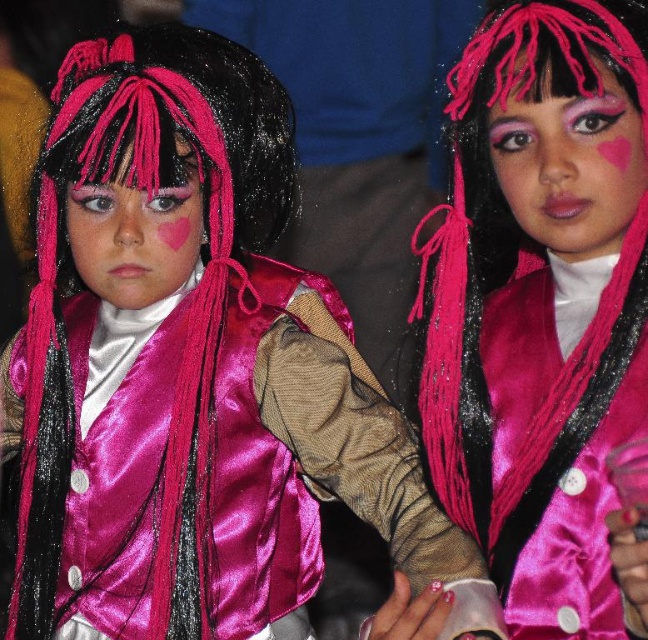
Can you confirm if satin pink vest at center is positioned to the left of matte pink wig at left?

Incorrect, satin pink vest at center is not on the left side of matte pink wig at left.

Is satin pink vest at center thinner than matte pink wig at left?

Incorrect, satin pink vest at center's width is not less than matte pink wig at left's.

I want to click on satin pink vest at center, so click(x=544, y=310).

The height and width of the screenshot is (640, 648). What are the coordinates of `satin pink vest at center` in the screenshot? It's located at (544, 310).

Does satin pink vest at center come in front of pink matte wig at center?

Yes.

Measure the distance from satin pink vest at center to pink matte wig at center.

10.31 centimeters

Who is more distant from viewer, (575, 212) or (557, 97)?

The point (575, 212) is more distant.

This screenshot has height=640, width=648. Identify the location of satin pink vest at center. coord(544,310).

Between pink matte wig at center and matte pink wig at left, which one has more height?

With more height is pink matte wig at center.

Which is more to the left, pink matte wig at center or matte pink wig at left?

matte pink wig at left is more to the left.

Locate an element on the screen. This screenshot has width=648, height=640. pink matte wig at center is located at coordinates (570, 163).

The height and width of the screenshot is (640, 648). What are the coordinates of `pink matte wig at center` in the screenshot? It's located at (570, 163).